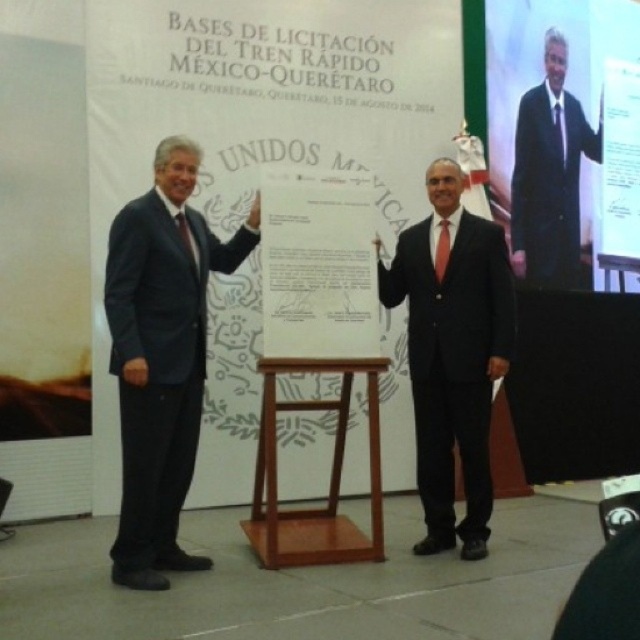
Which of these two, black glossy suit at center or matte black suit at upper right, stands shorter?

black glossy suit at center

Which is more to the right, black glossy suit at center or matte black suit at upper right?

matte black suit at upper right is more to the right.

Image resolution: width=640 pixels, height=640 pixels. What do you see at coordinates (452, 353) in the screenshot?
I see `black glossy suit at center` at bounding box center [452, 353].

Where is `black glossy suit at center`? Image resolution: width=640 pixels, height=640 pixels. black glossy suit at center is located at coordinates (452, 353).

Which is below, matte black suit at left or white paper at center?

matte black suit at left is below.

Does point (152, 365) come closer to viewer compared to point (337, 252)?

Yes, it is.

The image size is (640, 640). I want to click on matte black suit at left, so click(161, 356).

Between point (580, 147) and point (289, 564), which one is positioned behind?

The point (580, 147) is more distant.

Can you confirm if matte black suit at upper right is bigger than light brown wood stool at center?

Indeed, matte black suit at upper right has a larger size compared to light brown wood stool at center.

Locate an element on the screen. The width and height of the screenshot is (640, 640). matte black suit at upper right is located at coordinates (548, 177).

Where is `matte black suit at upper right`? matte black suit at upper right is located at coordinates (548, 177).